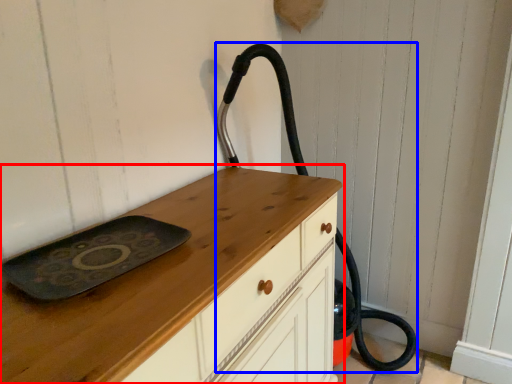
Question: Which of the following is the farthest to the observer, chest of drawers (highlighted by a red box) or fire hose (highlighted by a blue box)?

Choices:
 (A) chest of drawers
 (B) fire hose

Answer: (B)